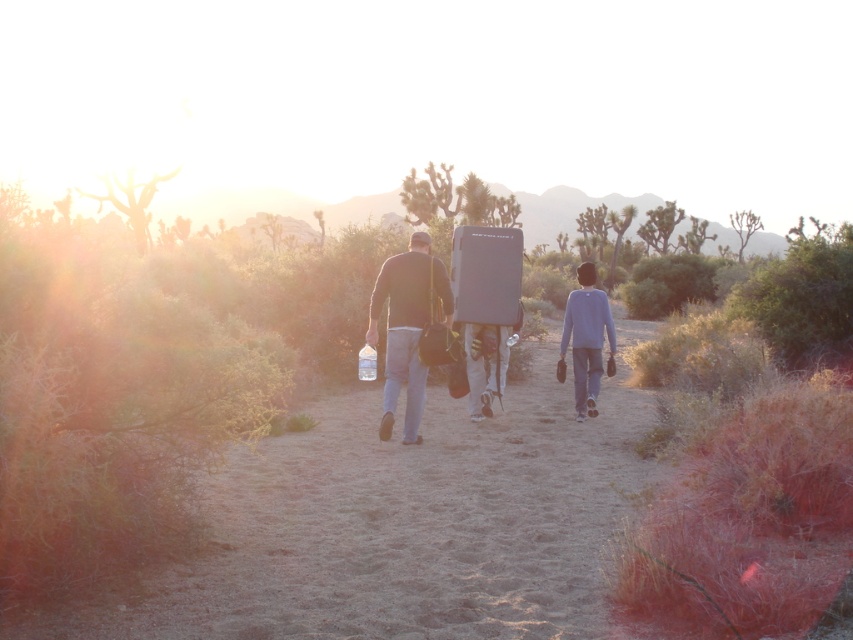
You are a photographer trying to capture a clear photo of the two people at the center of the desert scene. The matte black surfboard at center and the gray cotton shirt at center are both in your frame. Considering their positions, will the surfboard block the view of the shirt in your photo?

The matte black surfboard at center might be wider than gray cotton shirt at center, so there is a possibility that the surfboard could block the view of the shirt depending on their exact positioning and angles in the photo.

You are a photographer positioned at the starting point of the desert path. You want to capture a photo of the two people at the center of the image. Which object should you focus on first if you want to include both the matte black surfboard at center and the gray cotton shirt at center in your frame?

You should focus on the matte black surfboard at center first because it is positioned to the left of the gray cotton shirt at center, so capturing it first ensures both objects are included in the frame.

You are planning to walk across the brown sand at center while carrying the matte black surfboard at center. Considering their sizes, which one occupies more space in the scene?

The brown sand at center has a larger size compared to the matte black surfboard at center, so the brown sand at center occupies more space in the scene.